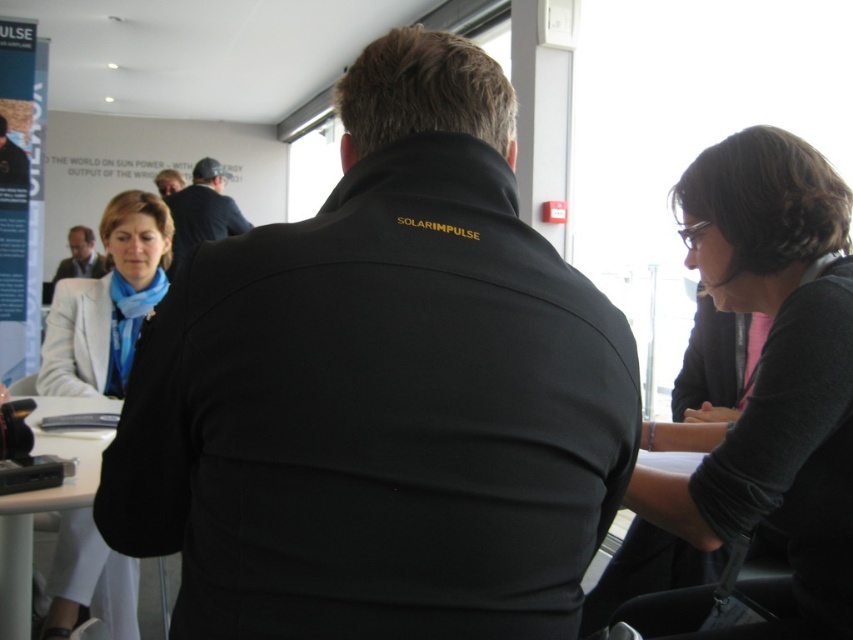
You are a photographer at the event and need to capture a photo of both the black softshell jacket at center and the dark blue shirt at center. From the perspective of someone standing behind the photographer, which object is on the left?

The dark blue shirt at center is on the left side of the black softshell jacket at center, so from the photographer perspective, the dark blue shirt at center would be on the left.

You are a photographer holding a camera. You want to take a photo of the dark gray sweater at right without moving the camera. Is the sweater within the camera lens range?

The dark gray sweater at right and camera are 1.06 meters apart, so yes, the sweater is within the camera lens range since the distance is within typical lens capabilities.

You are a photographer standing at the camera position. You need to place a small tripod on the white matte table at lower left. The tripod requires at least 1.5 meters of space between the camera and the table to avoid obstruction. Can you safely place the tripod on the table?

The distance between the white matte table at lower left and the camera is 1.46 meters, which is less than the required 1.5 meters. Therefore, placing the tripod on the white matte table at lower left may obstruct the camera view.